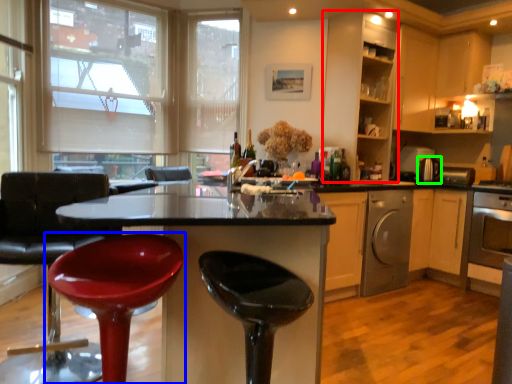
Question: Estimate the real-world distances between objects in this image. Which object is farther from cabinetry (highlighted by a red box), chair (highlighted by a blue box) or appliance (highlighted by a green box)?

Choices:
 (A) chair
 (B) appliance

Answer: (A)